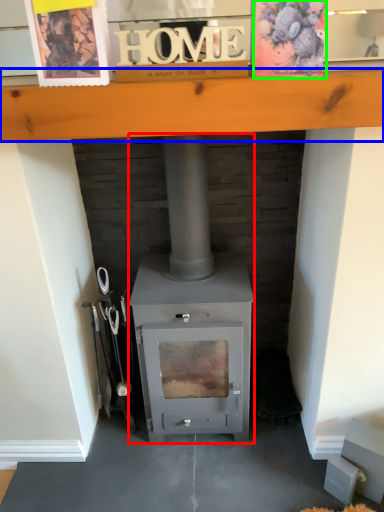
Question: Considering the real-world distances, which object is closest to wood burning stove (highlighted by a red box)? ledge (highlighted by a blue box) or postcard (highlighted by a green box).

Choices:
 (A) ledge
 (B) postcard

Answer: (A)